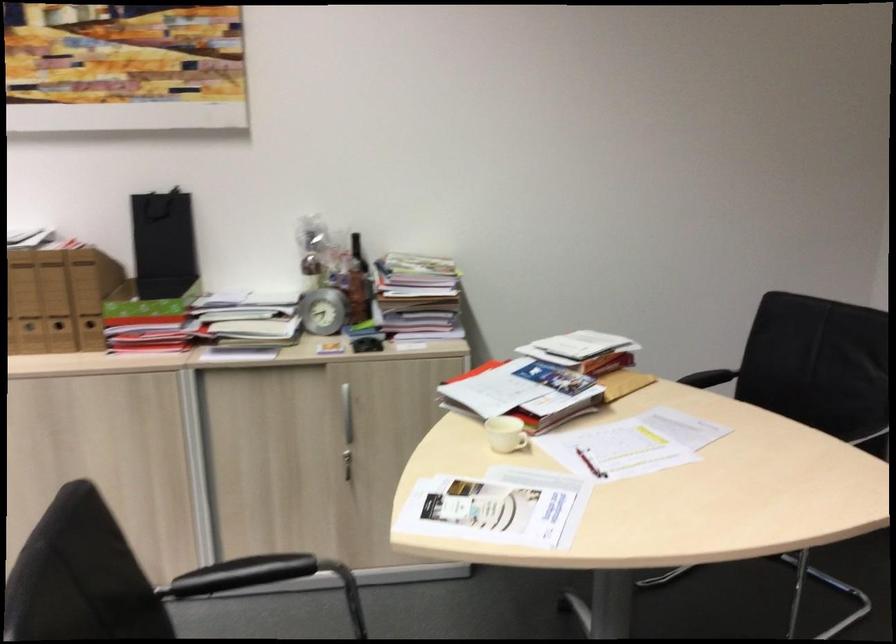
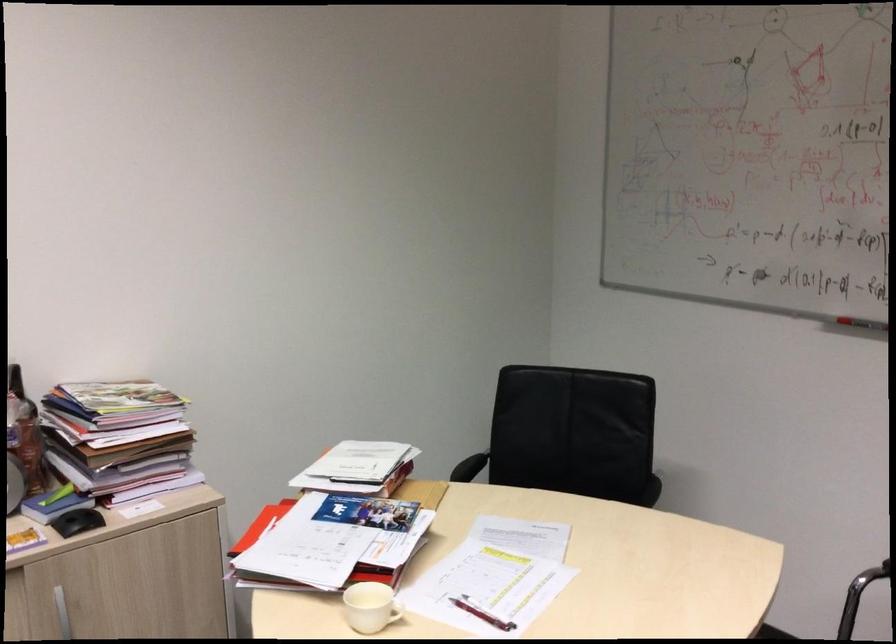
Locate, in the second image, the point that corresponds to [512,431] in the first image.

(369, 607)